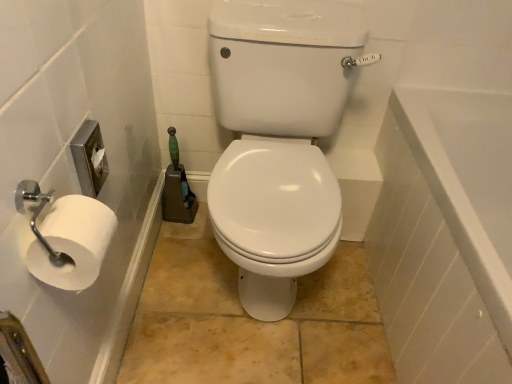
Question: From a real-world perspective, is white glossy bathtub at right under white matte toilet paper at left?

Choices:
 (A) yes
 (B) no

Answer: (A)

Question: Is the position of white glossy bathtub at right less distant than that of white matte toilet paper at left?

Choices:
 (A) no
 (B) yes

Answer: (A)

Question: Is white glossy bathtub at right to the right of white matte toilet paper at left from the viewer's perspective?

Choices:
 (A) no
 (B) yes

Answer: (B)

Question: Would you say white glossy bathtub at right contains white matte toilet paper at left?

Choices:
 (A) yes
 (B) no

Answer: (B)

Question: Is the surface of white glossy bathtub at right in direct contact with white matte toilet paper at left?

Choices:
 (A) no
 (B) yes

Answer: (A)

Question: Can you confirm if white glossy bathtub at right is positioned to the left of white matte toilet paper at left?

Choices:
 (A) no
 (B) yes

Answer: (A)

Question: Is white matte toilet paper at left closer to camera compared to white glossy bathtub at right?

Choices:
 (A) yes
 (B) no

Answer: (A)

Question: Can we say white matte toilet paper at left lies outside white glossy bathtub at right?

Choices:
 (A) yes
 (B) no

Answer: (A)

Question: From the image's perspective, is white matte toilet paper at left on top of white glossy bathtub at right?

Choices:
 (A) yes
 (B) no

Answer: (A)

Question: From a real-world perspective, is white matte toilet paper at left physically below white glossy bathtub at right?

Choices:
 (A) yes
 (B) no

Answer: (B)

Question: Is white matte toilet paper at left thinner than white glossy bathtub at right?

Choices:
 (A) yes
 (B) no

Answer: (A)

Question: Does white matte toilet paper at left have a smaller size compared to white glossy bathtub at right?

Choices:
 (A) no
 (B) yes

Answer: (B)

Question: Is white glossy toilet seat at center not close to white matte toilet paper at left?

Choices:
 (A) no
 (B) yes

Answer: (A)